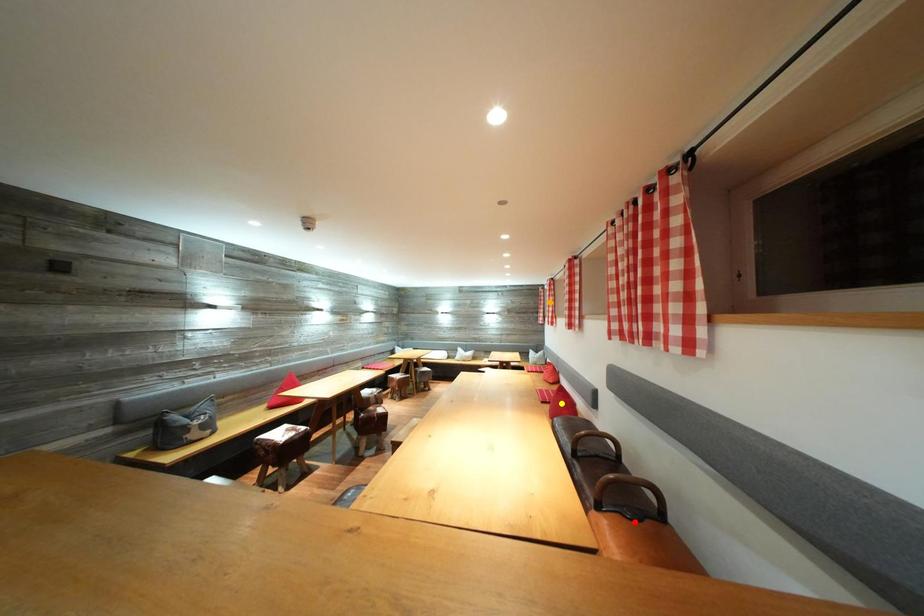
Order these from nearest to farthest:
orange point | red point | yellow point

red point
yellow point
orange point